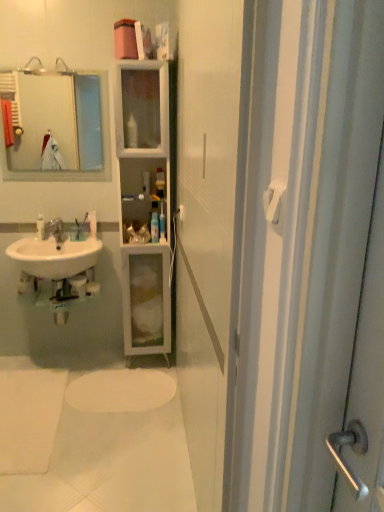
Question: From a real-world perspective, is white plastic bottle at center, which appears as the third toiletry when viewed from the left, beneath clear plastic toothbrush at center, which is the third toiletry in right-to-left order?

Choices:
 (A) yes
 (B) no

Answer: (B)

Question: Is clear plastic toothbrush at center, which is the third toiletry in right-to-left order, a part of white plastic bottle at center, which appears as the 2th toiletry when viewed from the right?

Choices:
 (A) no
 (B) yes

Answer: (A)

Question: Is white plastic bottle at center, which appears as the third toiletry when viewed from the left, outside clear plastic toothbrush at center, which is the third toiletry in right-to-left order?

Choices:
 (A) yes
 (B) no

Answer: (A)

Question: Is white plastic bottle at center, which appears as the 2th toiletry when viewed from the right, facing away from clear plastic toothbrush at center, the second toiletry from the left?

Choices:
 (A) yes
 (B) no

Answer: (B)

Question: Does white plastic bottle at center, which appears as the 2th toiletry when viewed from the right, come behind clear plastic toothbrush at center, the second toiletry from the left?

Choices:
 (A) yes
 (B) no

Answer: (B)

Question: Could you tell me if white plastic bottle at center, which appears as the 2th toiletry when viewed from the right, is turned towards clear plastic toothbrush at center, the second toiletry from the left?

Choices:
 (A) yes
 (B) no

Answer: (B)

Question: Considering the relative sizes of brushed metal faucet at lower left and translucent plastic bottle at center, the 4th toiletry viewed from the left, in the image provided, is brushed metal faucet at lower left taller than translucent plastic bottle at center, the 4th toiletry viewed from the left,?

Choices:
 (A) yes
 (B) no

Answer: (B)

Question: Is brushed metal faucet at lower left behind translucent plastic bottle at center, the 4th toiletry viewed from the left?

Choices:
 (A) yes
 (B) no

Answer: (B)

Question: Is brushed metal faucet at lower left positioned in front of translucent plastic bottle at center, the 4th toiletry viewed from the left?

Choices:
 (A) yes
 (B) no

Answer: (A)

Question: From the image's perspective, does brushed metal faucet at lower left appear higher than translucent plastic bottle at center, which appears as the first toiletry when viewed from the right?

Choices:
 (A) yes
 (B) no

Answer: (B)

Question: Is brushed metal faucet at lower left to the left of translucent plastic bottle at center, which appears as the first toiletry when viewed from the right, from the viewer's perspective?

Choices:
 (A) no
 (B) yes

Answer: (B)

Question: Is the surface of brushed metal faucet at lower left in direct contact with translucent plastic bottle at center, the 4th toiletry viewed from the left?

Choices:
 (A) yes
 (B) no

Answer: (B)

Question: Considering the relative sizes of white plastic towel bar at upper right and white glossy toothbrush at left, the 1th toiletry in the left-to-right sequence, in the image provided, is white plastic towel bar at upper right bigger than white glossy toothbrush at left, the 1th toiletry in the left-to-right sequence,?

Choices:
 (A) no
 (B) yes

Answer: (A)